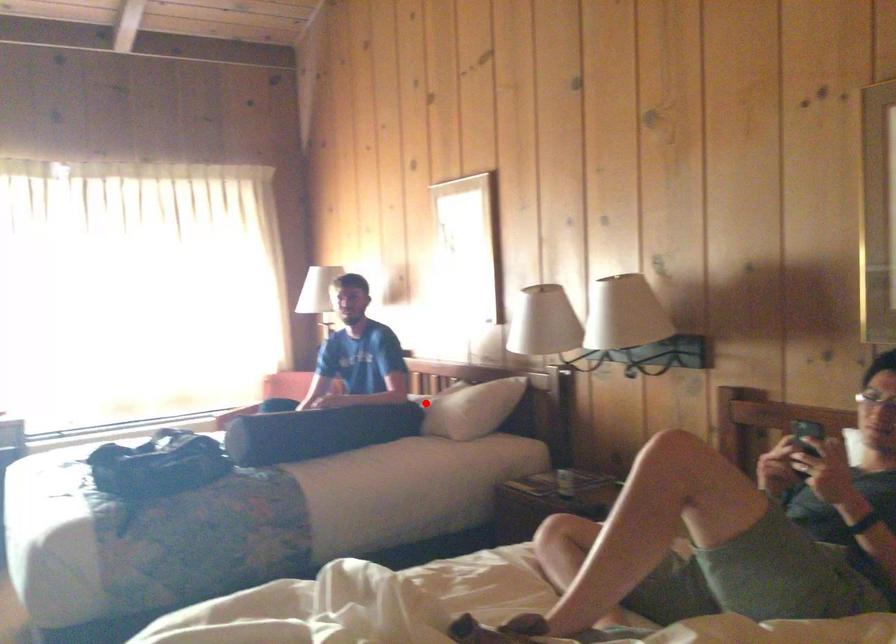
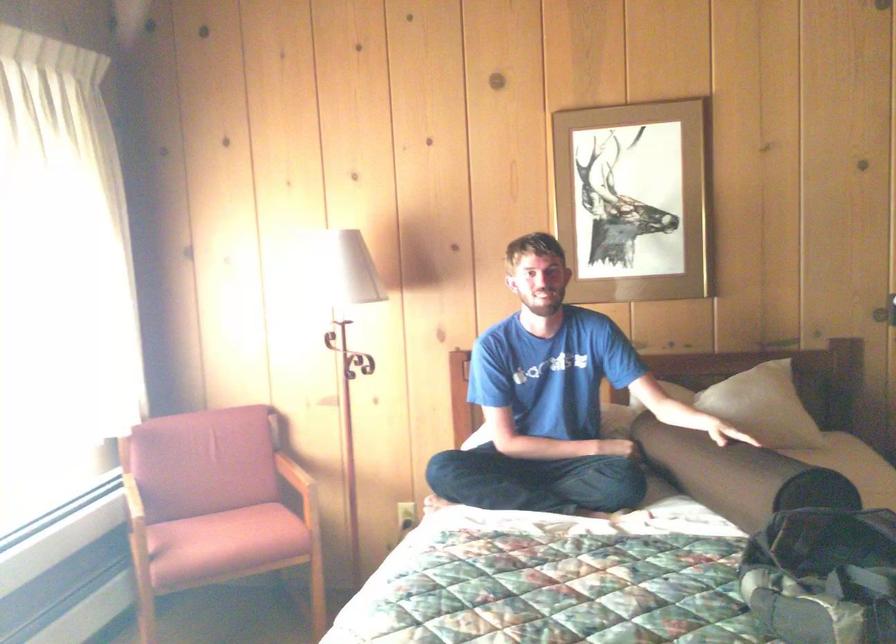
Question: A red point is marked in image1. In image2, is the corresponding 3D point closer to the camera or farther? Reply with the corresponding letter.

Choices:
 (A) The corresponding 3D point is closer.
 (B) The corresponding 3D point is farther.

Answer: (A)